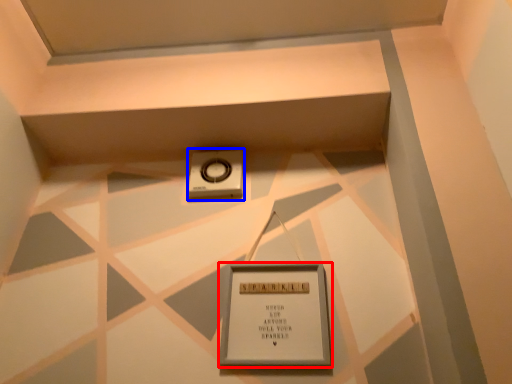
Question: Which point is further to the camera, picture frame (highlighted by a red box) or weight scale (highlighted by a blue box)?

Choices:
 (A) picture frame
 (B) weight scale

Answer: (B)